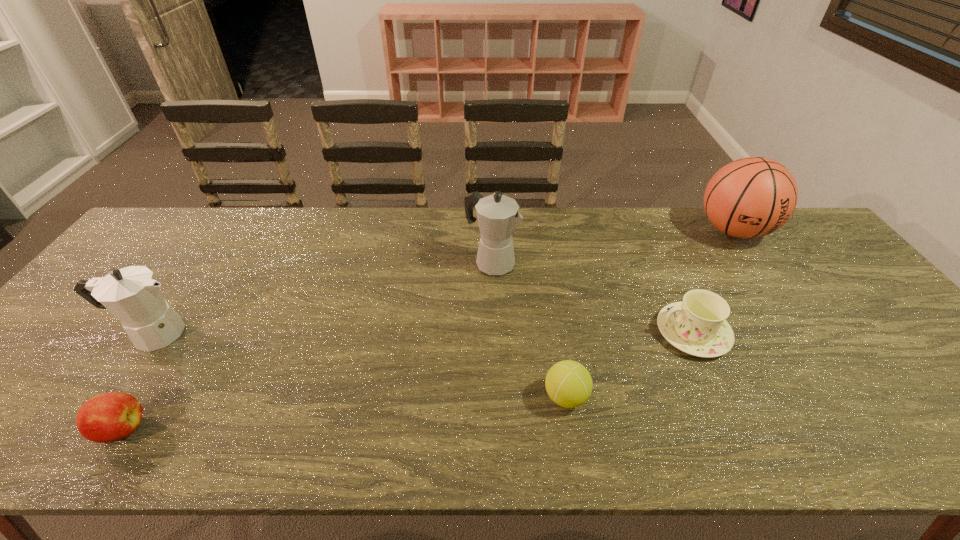
Find the location of a particular element. The image size is (960, 540). vacant area situated 0.380m on the handle side of the chinaware is located at coordinates (507, 333).

This screenshot has height=540, width=960. In order to click on vacant space located 0.160m on the handle side of the chinaware in this screenshot , I will do `click(594, 333)`.

Identify the location of vacant space located 0.110m on the handle side of the chinaware. (613, 333).

At what (x,y) coordinates should I click in order to perform the action: click on free space located 0.180m on the right of the tennis ball. Please return your answer as a coordinate pair (x, y). This screenshot has height=540, width=960. Looking at the image, I should click on (669, 396).

You are a GUI agent. You are given a task and a screenshot of the screen. Output one action in this format:
    pyautogui.click(x=<x>, y=<y>)
    Task: Click on the vacant area located 0.210m on the back of the apple
    The width and height of the screenshot is (960, 540).
    Given the screenshot: What is the action you would take?
    pyautogui.click(x=182, y=334)

The height and width of the screenshot is (540, 960). In order to click on coffeepot that is at the far edge in this screenshot , I will do `click(498, 217)`.

The height and width of the screenshot is (540, 960). Identify the location of basketball that is at the far edge. (751, 197).

The height and width of the screenshot is (540, 960). Find the location of `tennis ball at the near edge`. tennis ball at the near edge is located at coordinates (568, 383).

I want to click on apple that is at the near edge, so click(x=109, y=417).

Locate an element on the screen. The height and width of the screenshot is (540, 960). object present at the left edge is located at coordinates (132, 294).